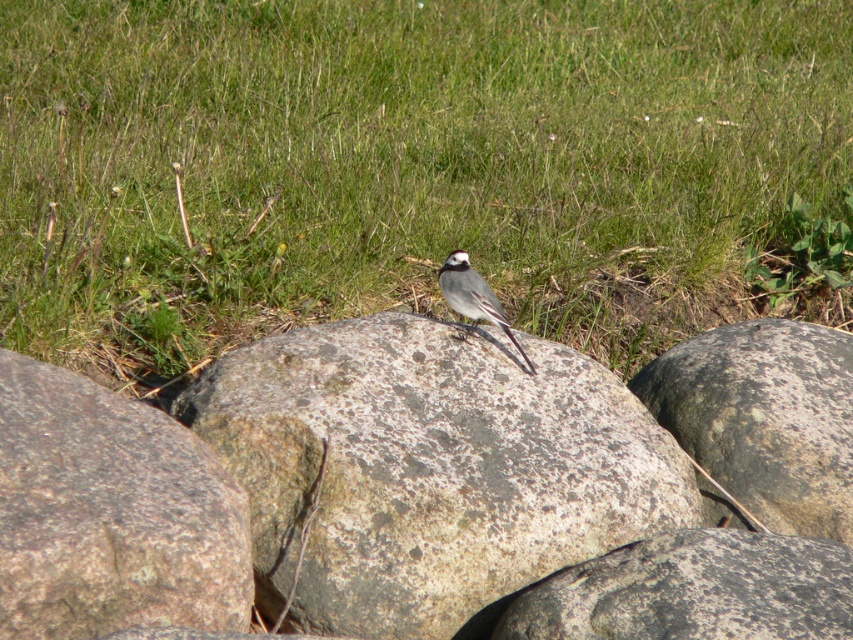
In the scene shown: The scene shows a bird on a rock in a grassy area. There is a point marked at coordinates (x=428, y=470). What does this point indicate?

The point at (x=428, y=470) indicates the speckled stone boulder at center where the bird is perched.

You are standing in the natural outdoor setting shown in the image. You want to place a small marker at the point labeled as point [413,170]. Based on the scene description, what will the marker be placed on?

The point [413,170] corresponds to green grass at center, so the marker will be placed on the green grass at center.